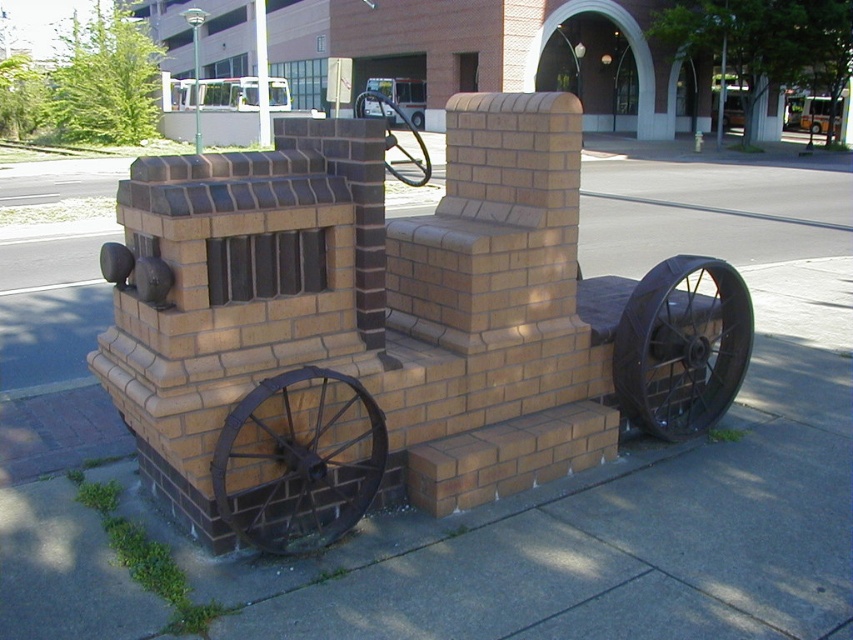
Is black metal/wrought iron wheel at lower left thinner than black metal/wrought iron wheel at lower right?

Yes, black metal/wrought iron wheel at lower left is thinner than black metal/wrought iron wheel at lower right.

Between point (329, 532) and point (621, 360), which one is positioned behind?

The point (621, 360) is more distant.

Which is behind, point (378, 436) or point (631, 294)?

The point (631, 294) is behind.

Identify the location of black metal/wrought iron wheel at lower left. This screenshot has width=853, height=640. (299, 460).

From the picture: Does rustic metal wheel at center come in front of black rubber tire at center?

Yes, it is in front of black rubber tire at center.

Is rustic metal wheel at center shorter than black rubber tire at center?

In fact, rustic metal wheel at center may be taller than black rubber tire at center.

Which is behind, point (355, 109) or point (415, 124)?

The point (415, 124) is behind.

Image resolution: width=853 pixels, height=640 pixels. Identify the location of rustic metal wheel at center. (396, 141).

Who is higher up, black metal/wrought iron wheel at lower right or black rubber tire at center?

black rubber tire at center is above.

Does black metal/wrought iron wheel at lower right appear under black rubber tire at center?

Yes.

Who is more forward, (688, 412) or (419, 125)?

Positioned in front is point (688, 412).

Where is `black metal/wrought iron wheel at lower right`? The image size is (853, 640). black metal/wrought iron wheel at lower right is located at coordinates (682, 346).